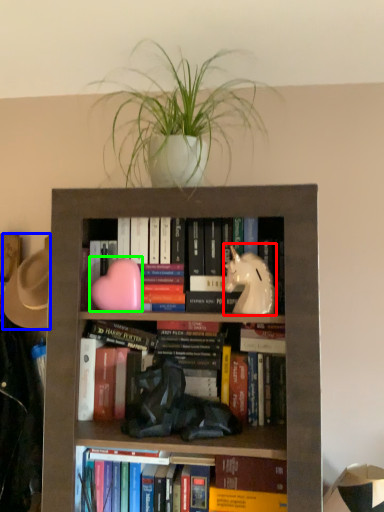
Question: Considering the real-world distances, which object is farthest from animal (highlighted by a red box)? hat (highlighted by a blue box) or animal (highlighted by a green box)?

Choices:
 (A) hat
 (B) animal

Answer: (A)